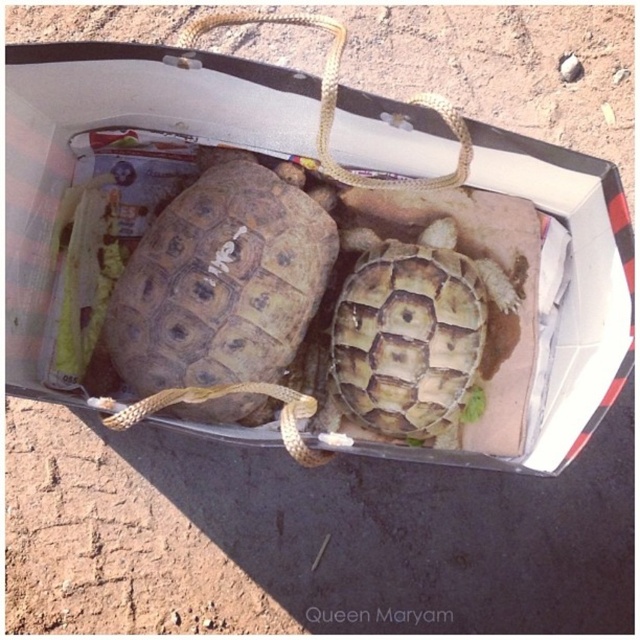
You are a delivery person who needs to place a small package between the brown textured tortoise at center and the rusty metal tortoise at center in the box. The package is 10 inches long. Will it fit between them without overlapping either tortoise?

The distance between the brown textured tortoise at center and the rusty metal tortoise at center is 8.43 inches. Since the package is 10 inches long, it will not fit between them without overlapping either tortoise.

You are holding a camera and want to take a photo of the matte cardboard box at center. If you are currently 1.03 meters away from it, is this distance considered close enough for a detailed closeup shot?

The matte cardboard box at center and camera are 1.03 meters apart from each other. Whether this distance is close enough for a detailed closeup depends on the camera specifications, but typically, 1 meter is within the close focus range for many cameras to capture details.

You are packing a box and need to place the brown textured tortoise at center and the rusty metal tortoise at center inside. Given their current positions in the box, which tortoise is closer to the left edge of the box?

The brown textured tortoise at center is closer to the left edge of the box because it is positioned on the left side of the rusty metal tortoise at center.